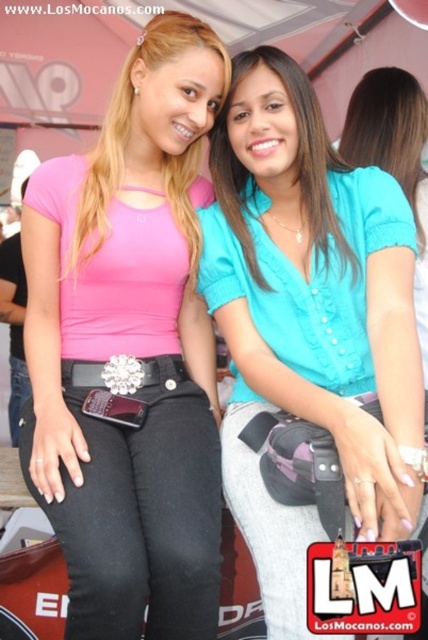
You are a photographer standing at the camera position. You want to take a photo of the smooth teal blouse at center. Can you capture the entire blouse in your shot if your camera has a maximum zoom of 2x? Assume the camera sensor can capture objects within 3 meters clearly without zooming.

The smooth teal blouse at center and camera are 4.58 meters apart from each other. Since the camera can only capture objects within 3 meters clearly without zooming, you would need to use the 2x zoom to capture the blouse at 4.58 meters. However, zooming may reduce image quality. Alternatively, moving closer to the blouse would ensure a clearer image without zoom.

You are a fashion designer trying to create a matching accessory set for the two items at the center of the image. The matte teal blouse at center and the silver metallic belt at center. To ensure the accessories will fit, you need to know which item has a greater width. Can you determine which one is wider?

The matte teal blouse at center might be wider than silver metallic belt at center according to the description, so the blouse is likely the wider item.